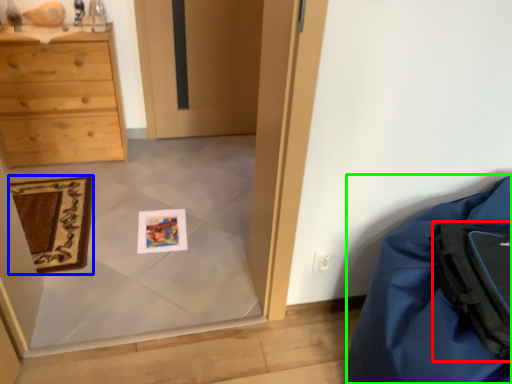
Question: Based on their relative distances, which object is farther from backpack (highlighted by a red box)? Choose from mat (highlighted by a blue box) and furniture (highlighted by a green box).

Choices:
 (A) mat
 (B) furniture

Answer: (A)